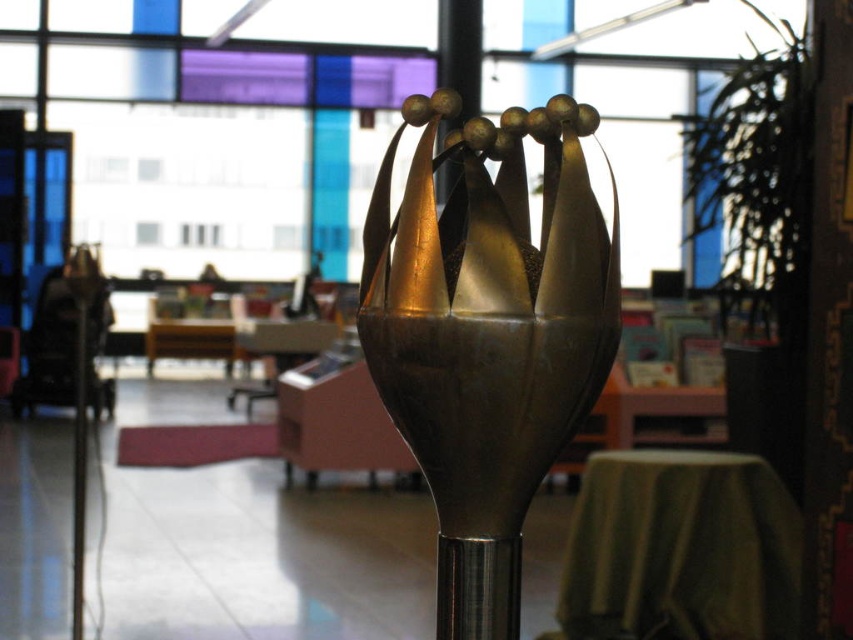
Based on the photo, is gold polished metal crown at center thinner than green fabric table at center?

Indeed, gold polished metal crown at center has a lesser width compared to green fabric table at center.

Is gold polished metal crown at center bigger than green fabric table at center?

No.

Who is more forward, (480, 561) or (616, 467)?

Positioned in front is point (480, 561).

Identify the location of gold polished metal crown at center. The image size is (853, 640). (486, 333).

Is green fabric table at center bigger than metallic pole at center?

Correct, green fabric table at center is larger in size than metallic pole at center.

Who is lower down, green fabric table at center or metallic pole at center?

Positioned lower is green fabric table at center.

Is point (639, 557) less distant than point (83, 346)?

No, (639, 557) is behind (83, 346).

The height and width of the screenshot is (640, 853). Find the location of `green fabric table at center`. green fabric table at center is located at coordinates (680, 548).

From the picture: Is gold polished metal crown at center wider than metallic pole at center?

Indeed, gold polished metal crown at center has a greater width compared to metallic pole at center.

Is gold polished metal crown at center taller than metallic pole at center?

No.

What do you see at coordinates (486, 333) in the screenshot? I see `gold polished metal crown at center` at bounding box center [486, 333].

Find the location of a particular element. gold polished metal crown at center is located at coordinates 486,333.